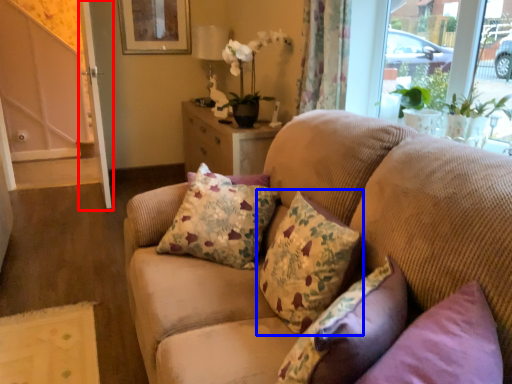
Question: Which point is closer to the camera, screen door (highlighted by a red box) or pillow (highlighted by a blue box)?

Choices:
 (A) screen door
 (B) pillow

Answer: (B)